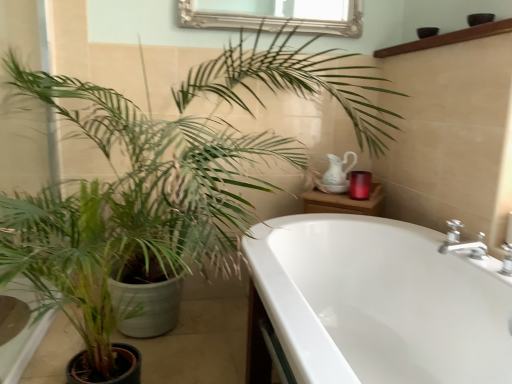
Question: From the image's perspective, does green matte plant at left appear lower than white glossy bathtub at lower right?

Choices:
 (A) yes
 (B) no

Answer: (B)

Question: From a real-world perspective, is green matte plant at left positioned under white glossy bathtub at lower right based on gravity?

Choices:
 (A) yes
 (B) no

Answer: (B)

Question: Would you consider green matte plant at left to be distant from white glossy bathtub at lower right?

Choices:
 (A) yes
 (B) no

Answer: (B)

Question: Can you confirm if green matte plant at left is taller than white glossy bathtub at lower right?

Choices:
 (A) no
 (B) yes

Answer: (B)

Question: From the image's perspective, would you say green matte plant at left is positioned over white glossy bathtub at lower right?

Choices:
 (A) no
 (B) yes

Answer: (B)

Question: From a real-world perspective, is green matte plant at left positioned over white glossy bathtub at lower right based on gravity?

Choices:
 (A) yes
 (B) no

Answer: (A)

Question: Does white glossy bathtub at lower right have a lesser height compared to brown wooden balustrade at upper right?

Choices:
 (A) no
 (B) yes

Answer: (A)

Question: Considering the relative sizes of white glossy bathtub at lower right and brown wooden balustrade at upper right in the image provided, is white glossy bathtub at lower right taller than brown wooden balustrade at upper right?

Choices:
 (A) yes
 (B) no

Answer: (A)

Question: Does white glossy bathtub at lower right come in front of brown wooden balustrade at upper right?

Choices:
 (A) no
 (B) yes

Answer: (B)

Question: Is white glossy bathtub at lower right looking in the opposite direction of brown wooden balustrade at upper right?

Choices:
 (A) no
 (B) yes

Answer: (A)

Question: From the image's perspective, is white glossy bathtub at lower right under brown wooden balustrade at upper right?

Choices:
 (A) yes
 (B) no

Answer: (A)

Question: Does white glossy bathtub at lower right contain brown wooden balustrade at upper right?

Choices:
 (A) no
 (B) yes

Answer: (A)

Question: From a real-world perspective, is brown wooden balustrade at upper right physically below green matte plant at left?

Choices:
 (A) yes
 (B) no

Answer: (B)